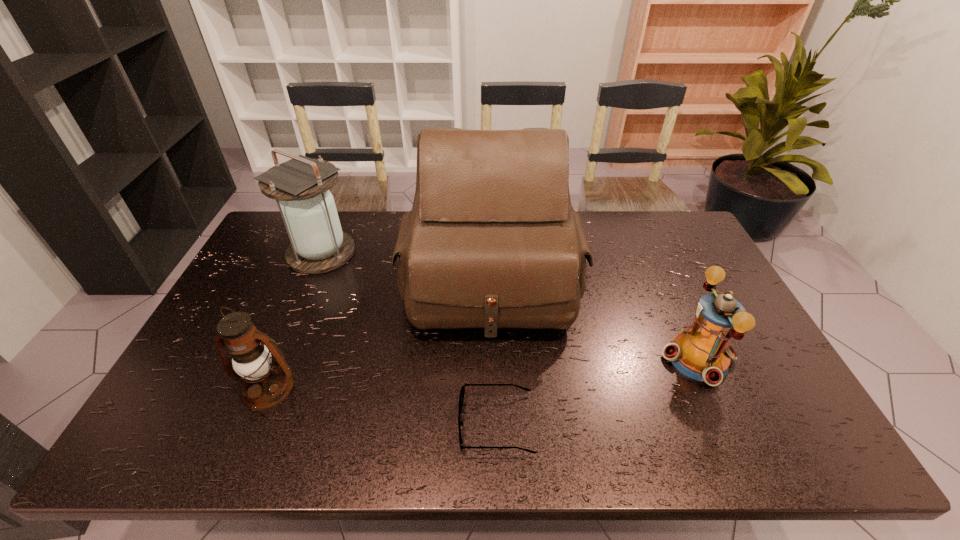
This screenshot has height=540, width=960. Identify the location of vacant space located on the front-facing side of the spectacles. (403, 423).

I want to click on vacant area situated 0.170m on the front-facing side of the spectacles, so click(x=386, y=423).

Locate an element on the screen. free location located on the front-facing side of the spectacles is located at coordinates (403, 423).

The width and height of the screenshot is (960, 540). What are the coordinates of `satchel present at the far edge` in the screenshot? It's located at (491, 242).

The image size is (960, 540). What are the coordinates of `lantern at the far edge` in the screenshot? It's located at (318, 245).

Locate an element on the screen. This screenshot has height=540, width=960. object present at the near edge is located at coordinates (462, 392).

The height and width of the screenshot is (540, 960). Find the location of `object present at the right edge`. object present at the right edge is located at coordinates (702, 352).

Image resolution: width=960 pixels, height=540 pixels. Identify the location of object that is at the far left corner. (318, 245).

Locate an element on the screen. This screenshot has height=540, width=960. vacant area at the near edge is located at coordinates point(423,458).

Locate an element on the screen. The image size is (960, 540). vacant area at the left edge of the desktop is located at coordinates (229, 301).